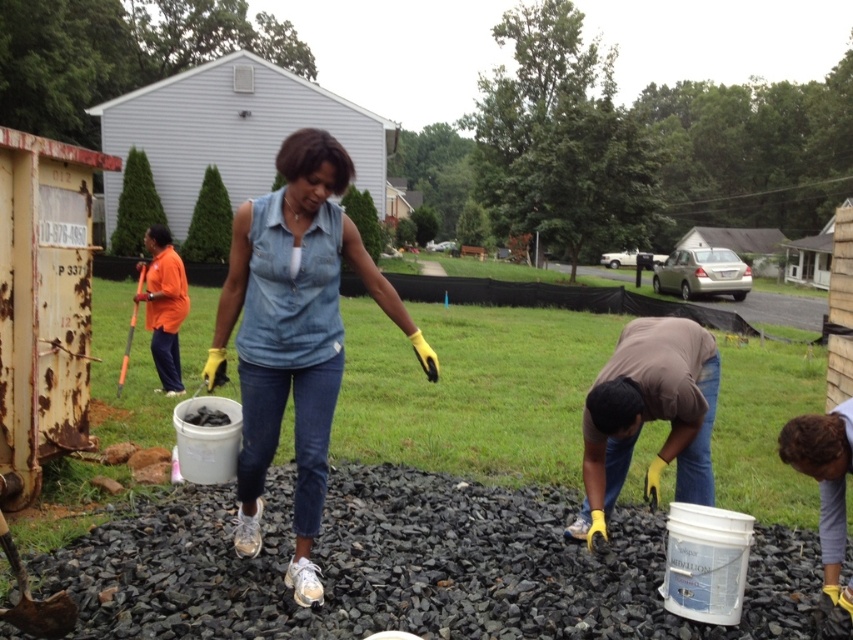
Is black gravel at center positioned before curly hair at lower right?

That is True.

Who is positioned more to the left, black gravel at center or curly hair at lower right?

black gravel at center is more to the left.

Image resolution: width=853 pixels, height=640 pixels. Describe the element at coordinates (410, 568) in the screenshot. I see `black gravel at center` at that location.

The width and height of the screenshot is (853, 640). In order to click on black gravel at center in this screenshot , I will do pos(410,568).

Does black gravel at center have a greater width compared to orange fabric shirt at left?

Incorrect, black gravel at center's width does not surpass orange fabric shirt at left's.

What do you see at coordinates (410, 568) in the screenshot? I see `black gravel at center` at bounding box center [410, 568].

What are the coordinates of `black gravel at center` in the screenshot? It's located at (410, 568).

Which is more to the right, curly hair at lower right or orange fabric shirt at left?

curly hair at lower right

Does curly hair at lower right appear on the right side of orange fabric shirt at left?

Yes, curly hair at lower right is to the right of orange fabric shirt at left.

Describe the element at coordinates (824, 481) in the screenshot. I see `curly hair at lower right` at that location.

Where is `curly hair at lower right`? The height and width of the screenshot is (640, 853). curly hair at lower right is located at coordinates (824, 481).